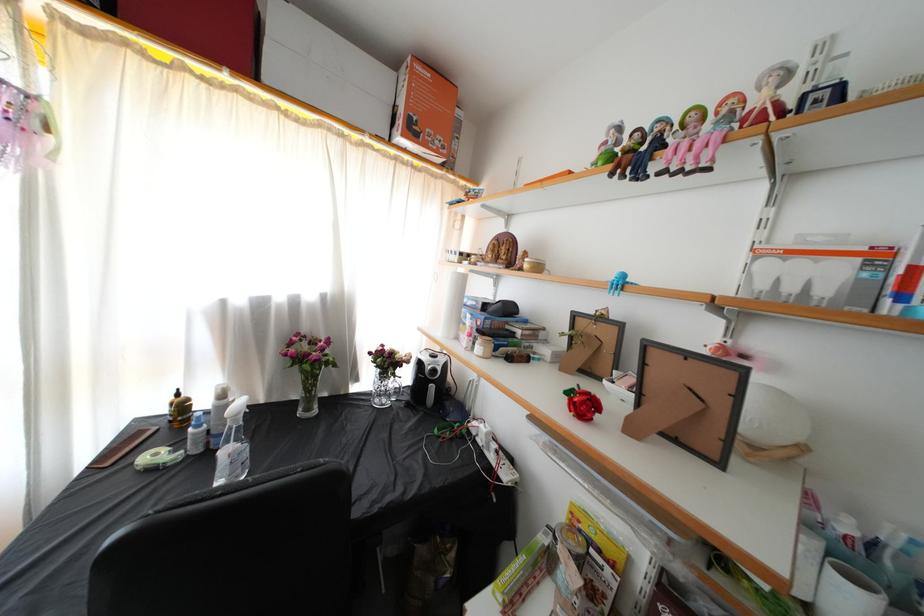
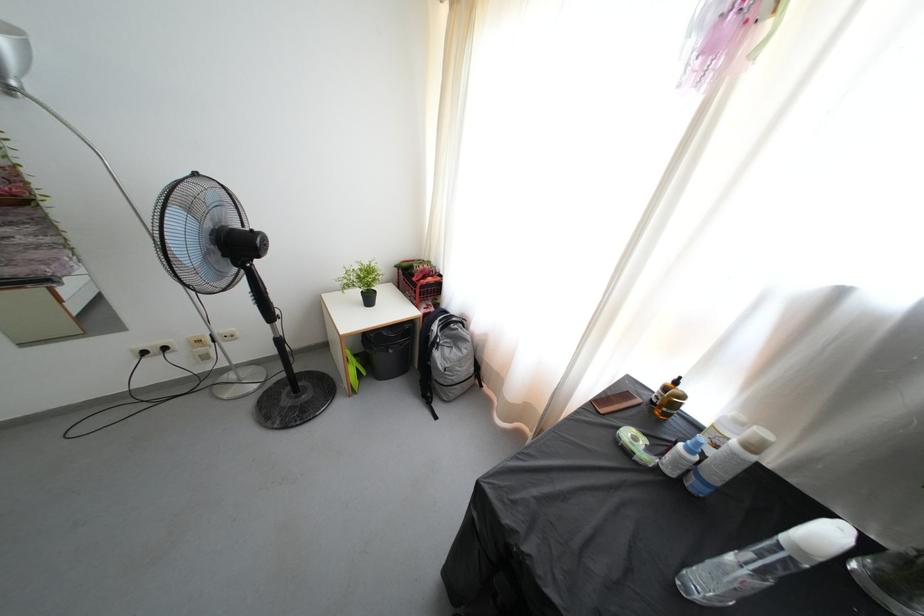
Locate, in the second image, the point that corresponds to [144,439] in the first image.

(633, 400)